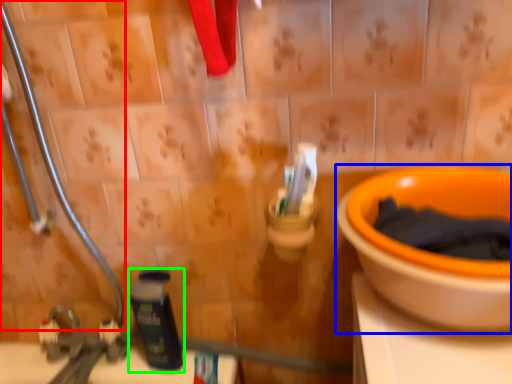
Question: Which is nearer to the pipe (highlighted by a red box)? toilet (highlighted by a blue box) or bottle (highlighted by a green box).

Choices:
 (A) toilet
 (B) bottle

Answer: (B)